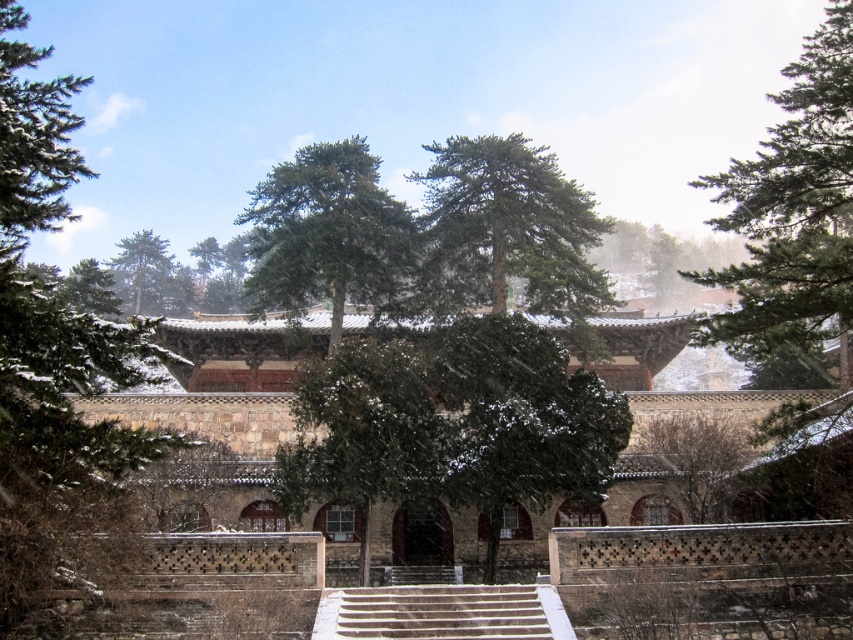
Which of these two, green textured pine tree at center or bare branches at center, stands shorter?

bare branches at center is shorter.

In order to click on green textured pine tree at center in this screenshot , I will do (55, 364).

The image size is (853, 640). I want to click on green textured pine tree at center, so click(x=55, y=364).

Who is taller, green leafy tree at center or green matte tree at center?

green matte tree at center is taller.

Can you confirm if green leafy tree at center is taller than green matte tree at center?

No.

Does point (363, 564) come in front of point (387, 212)?

Yes, it is.

Image resolution: width=853 pixels, height=640 pixels. Find the location of `green leafy tree at center`. green leafy tree at center is located at coordinates (453, 422).

Is point (759, 230) behind point (532, 179)?

No, it is not.

Between point (798, 333) and point (473, 280), which one is positioned in front?

Positioned in front is point (798, 333).

At what (x,y) coordinates should I click in order to perform the action: click on green needle-like tree at upper right. Please return your answer as a coordinate pair (x, y). The width and height of the screenshot is (853, 640). Looking at the image, I should click on (793, 211).